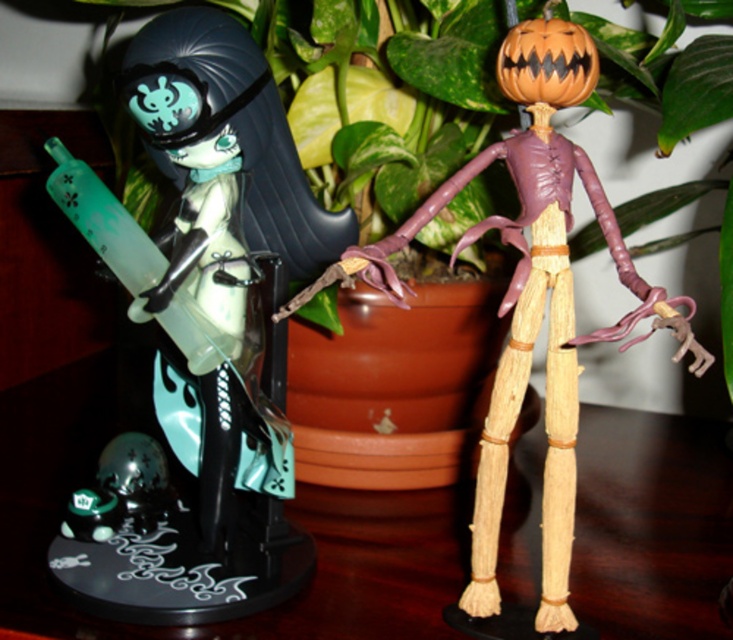
Which is below, matte green plastic figure at left or wooden skeleton at right?

Positioned lower is wooden skeleton at right.

Does matte green plastic figure at left appear on the left side of wooden skeleton at right?

Correct, you'll find matte green plastic figure at left to the left of wooden skeleton at right.

Image resolution: width=733 pixels, height=640 pixels. What do you see at coordinates (198, 337) in the screenshot?
I see `matte green plastic figure at left` at bounding box center [198, 337].

You are a GUI agent. You are given a task and a screenshot of the screen. Output one action in this format:
    pyautogui.click(x=<x>, y=<y>)
    Task: Click on the matte green plastic figure at left
    The image size is (733, 640).
    Given the screenshot: What is the action you would take?
    pyautogui.click(x=198, y=337)